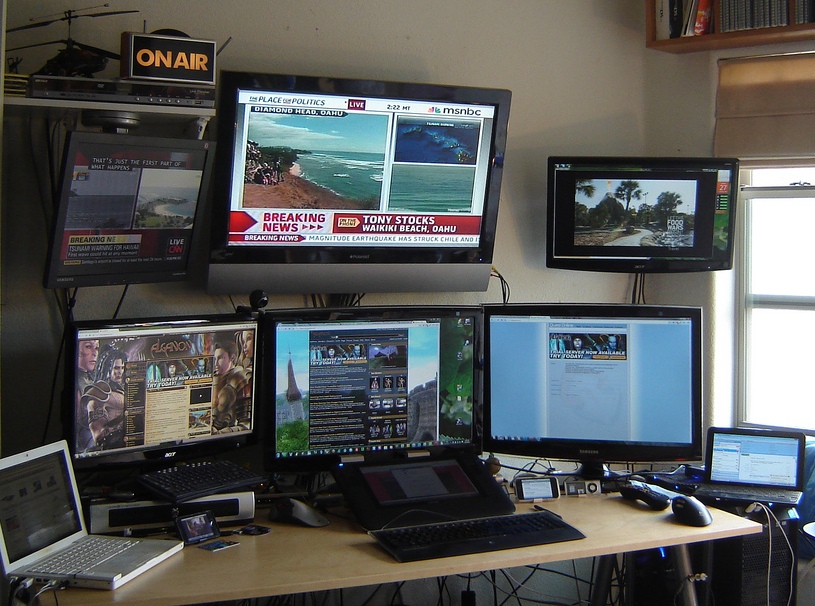
The height and width of the screenshot is (606, 815). In order to click on tv in this screenshot , I will do `click(126, 204)`, `click(341, 173)`, `click(671, 200)`.